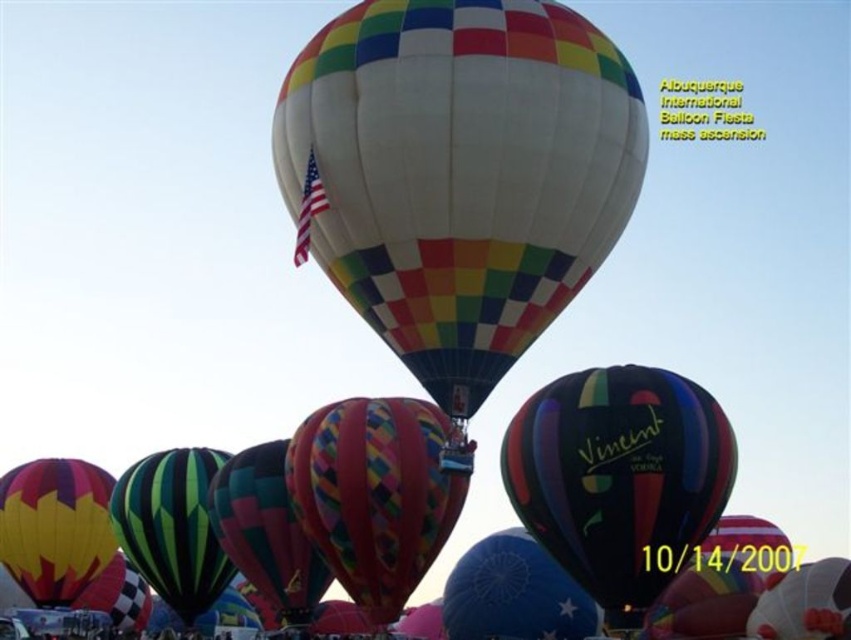
The image size is (851, 640). I want to click on rainbow checkered fabric hot air balloon at center, so click(x=460, y=173).

Which is in front, point (301, 184) or point (7, 529)?

Point (301, 184)

You are a GUI agent. You are given a task and a screenshot of the screen. Output one action in this format:
    pyautogui.click(x=<x>, y=<y>)
    Task: Click on the rainbow checkered fabric hot air balloon at center
    
    Given the screenshot: What is the action you would take?
    pyautogui.click(x=460, y=173)

Describe the element at coordinates (620, 477) in the screenshot. The image size is (851, 640). I see `multicolored glossy balloon at center` at that location.

Can you confirm if multicolored glossy balloon at center is positioned below yellow and red striped fabric hot air balloon at left?

Incorrect, multicolored glossy balloon at center is not positioned below yellow and red striped fabric hot air balloon at left.

At what (x,y) coordinates should I click in order to perform the action: click on multicolored glossy balloon at center. Please return your answer as a coordinate pair (x, y). The width and height of the screenshot is (851, 640). Looking at the image, I should click on (620, 477).

In order to click on multicolored glossy balloon at center in this screenshot , I will do `click(620, 477)`.

Is rainbow checkered fabric hot air balloon at center taller than multicolored fabric balloon at center?

Indeed, rainbow checkered fabric hot air balloon at center has a greater height compared to multicolored fabric balloon at center.

In order to click on rainbow checkered fabric hot air balloon at center in this screenshot , I will do `click(460, 173)`.